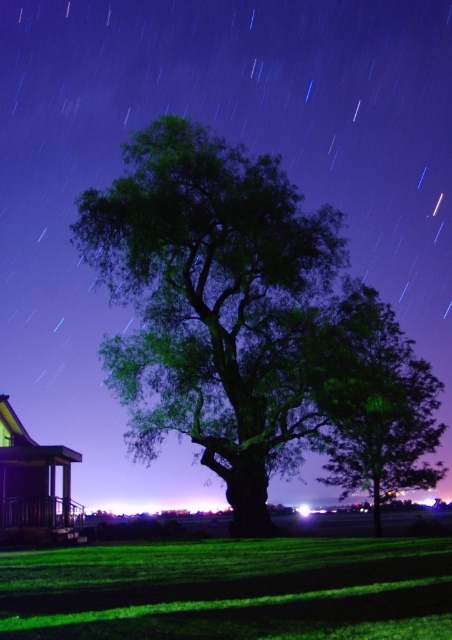
You are standing in the middle of a park at night and see two green leafy trees. One is labeled as a green leafy oak tree at center, and the other is labeled as a green leafy tree at center. Which tree has a wider spread of branches?

The green leafy oak tree at center has a wider spread of branches than the green leafy tree at center, as its width surpasses the other.

Consider the image. Based on the coordinates provided, which object in the scene is located at point (x=221, y=307)?

The point (x=221, y=307) marks the green leafy oak tree at center.

You are standing in a park at night and see the green leafy oak tree at center. If you want to take a photo of it with your smartphone camera, which has a maximum focus range of 20 meters, will you be able to capture the tree clearly?

The green leafy oak tree at center is 22.53 meters away from the camera. Since the maximum focus range of your smartphone camera is 20 meters, you will not be able to capture the tree clearly as it is beyond the camera range.